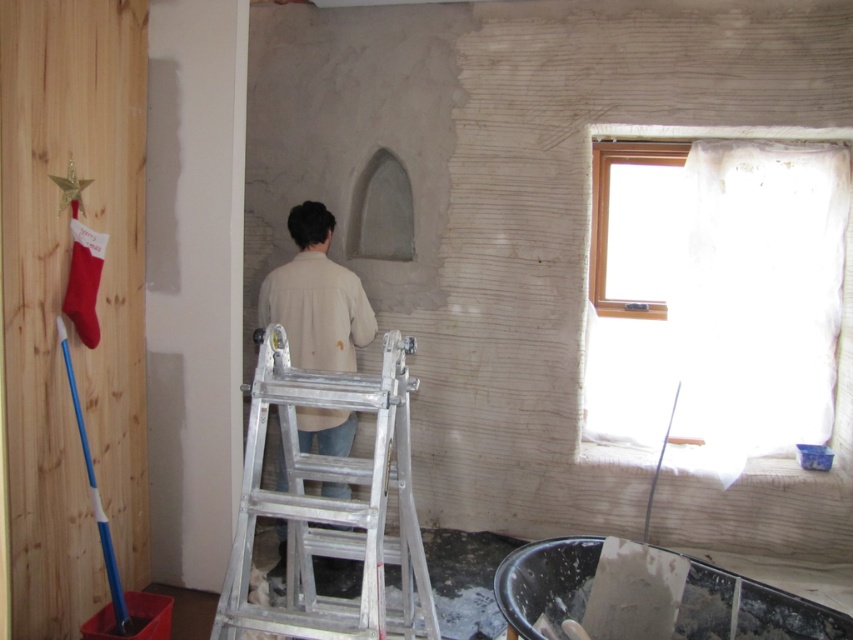
Question: Is aluminum ladder at center thinner than transparent plastic window at upper right?

Choices:
 (A) no
 (B) yes

Answer: (B)

Question: Is light beige shirt at center thinner than transparent plastic window at upper right?

Choices:
 (A) yes
 (B) no

Answer: (A)

Question: Which object is closer to the camera taking this photo?

Choices:
 (A) light beige shirt at center
 (B) transparent plastic window at upper right

Answer: (A)

Question: Which point is farther from the camera taking this photo?

Choices:
 (A) pos(848,218)
 (B) pos(218,632)

Answer: (A)

Question: Does aluminum ladder at center appear on the right side of light beige shirt at center?

Choices:
 (A) no
 (B) yes

Answer: (B)

Question: Which of the following is the closest to the observer?

Choices:
 (A) light beige shirt at center
 (B) transparent plastic window at upper right
 (C) aluminum ladder at center

Answer: (C)